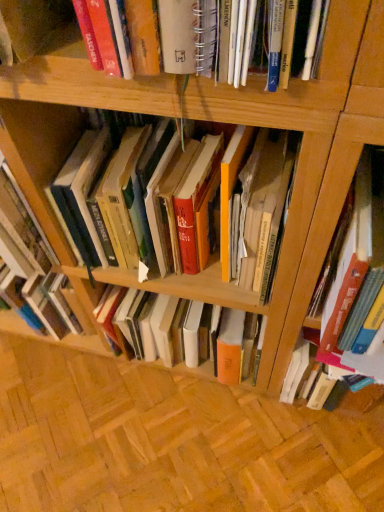
Question: Is hardcover book at center, which appears as the third book when viewed from the right, positioned behind hardcover book at right, which is the third book in left-to-right order?

Choices:
 (A) yes
 (B) no

Answer: (B)

Question: Does hardcover book at center, which appears as the third book when viewed from the right, lie in front of hardcover book at right, the 1th book from the right?

Choices:
 (A) no
 (B) yes

Answer: (B)

Question: From the image's perspective, is hardcover book at center, the first book from the left, under hardcover book at right, the 1th book from the right?

Choices:
 (A) no
 (B) yes

Answer: (A)

Question: Is hardcover book at center, which appears as the third book when viewed from the right, oriented away from hardcover book at right, the 1th book from the right?

Choices:
 (A) yes
 (B) no

Answer: (B)

Question: Does hardcover book at center, the first book from the left, have a greater width compared to hardcover book at right, the 1th book from the right?

Choices:
 (A) yes
 (B) no

Answer: (A)

Question: Is hardcover book at center, the first book from the left, oriented towards hardcover book at right, which is the third book in left-to-right order?

Choices:
 (A) no
 (B) yes

Answer: (A)

Question: Does hardcover book at right, the 1th book from the right, have a greater width compared to hardcover book at right, the second book viewed from the right?

Choices:
 (A) yes
 (B) no

Answer: (B)

Question: Is hardcover book at right, the 1th book from the right, at the right side of hardcover book at right, marked as the 2th book in a left-to-right arrangement?

Choices:
 (A) yes
 (B) no

Answer: (A)

Question: Is hardcover book at right, which is the third book in left-to-right order, next to hardcover book at right, the second book viewed from the right, and touching it?

Choices:
 (A) yes
 (B) no

Answer: (B)

Question: Considering the relative positions of hardcover book at right, the 1th book from the right, and hardcover book at right, the second book viewed from the right, in the image provided, is hardcover book at right, the 1th book from the right, in front of hardcover book at right, the second book viewed from the right,?

Choices:
 (A) yes
 (B) no

Answer: (B)

Question: Is there a large distance between hardcover book at right, the 1th book from the right, and hardcover book at right, the second book viewed from the right?

Choices:
 (A) yes
 (B) no

Answer: (B)

Question: Is hardcover book at right, which is the third book in left-to-right order, not inside hardcover book at right, the second book viewed from the right?

Choices:
 (A) no
 (B) yes

Answer: (B)

Question: Considering the relative sizes of hardcover book at right, the second book viewed from the right, and hardcover book at right, the 1th book from the right, in the image provided, is hardcover book at right, the second book viewed from the right, shorter than hardcover book at right, the 1th book from the right,?

Choices:
 (A) yes
 (B) no

Answer: (B)